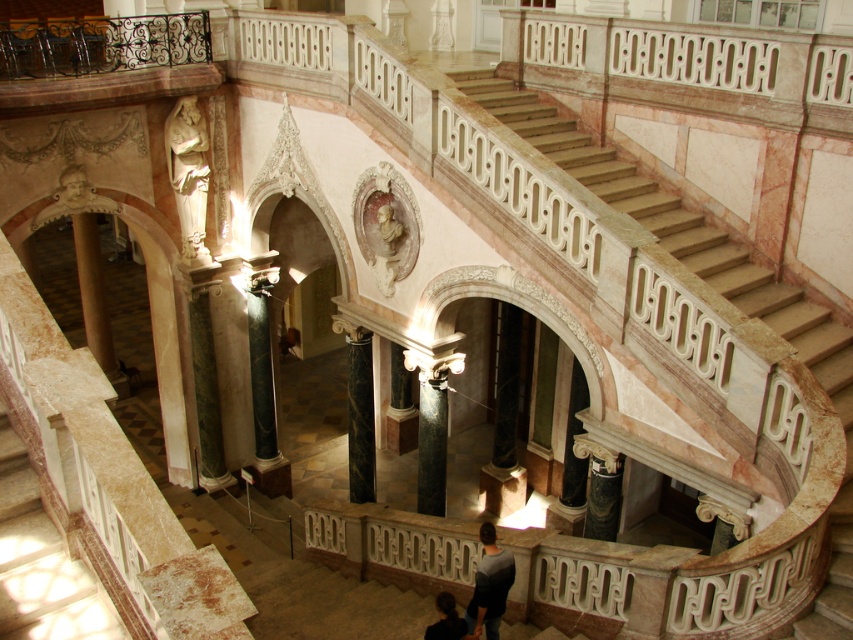
Question: Observing the image, what is the correct spatial positioning of marble stairs at center in reference to black marble column at center?

Choices:
 (A) above
 (B) below

Answer: (A)

Question: Among these points, which one is farthest from the camera?

Choices:
 (A) (491, 582)
 (B) (94, 298)
 (C) (712, 269)
 (D) (444, 614)

Answer: (B)

Question: Among these objects, which one is nearest to the camera?

Choices:
 (A) dark gray sweater at lower center
 (B) dark brown leather jacket at lower center
 (C) green marble pillar at lower left

Answer: (B)

Question: Where is marble stairs at center located in relation to green marble pillar at lower left in the image?

Choices:
 (A) right
 (B) left

Answer: (A)

Question: Which object is the farthest from the black marble column at center?

Choices:
 (A) dark brown leather jacket at lower center
 (B) green marble pillar at lower left
 (C) marble stairs at center
 (D) white marble statue at upper center

Answer: (B)

Question: In this image, where is green marble pillar at lower left located relative to dark gray sweater at lower center?

Choices:
 (A) right
 (B) left

Answer: (B)